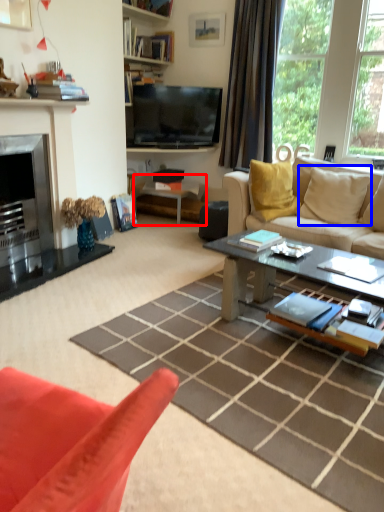
Question: Which point is further to the camera, side table (highlighted by a red box) or pillow (highlighted by a blue box)?

Choices:
 (A) side table
 (B) pillow

Answer: (A)